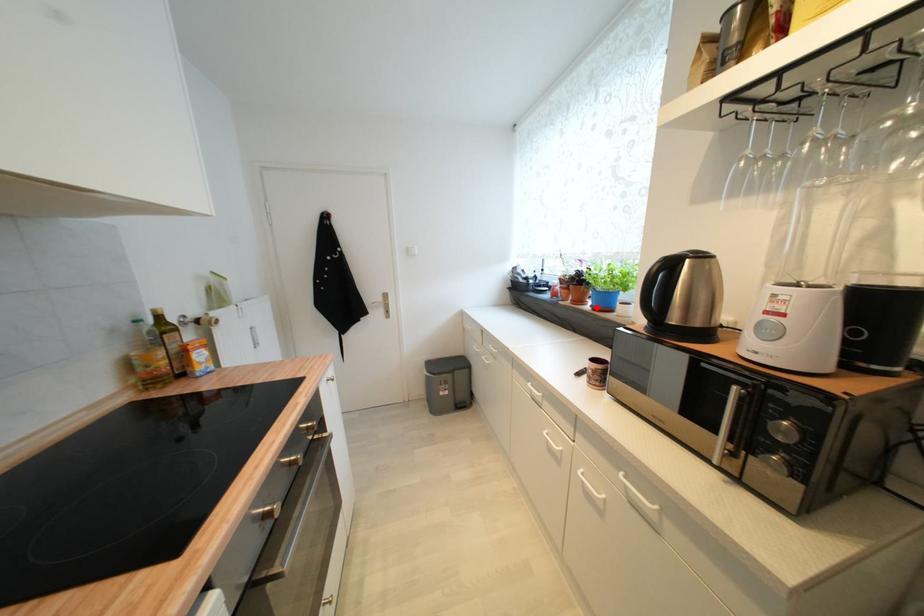
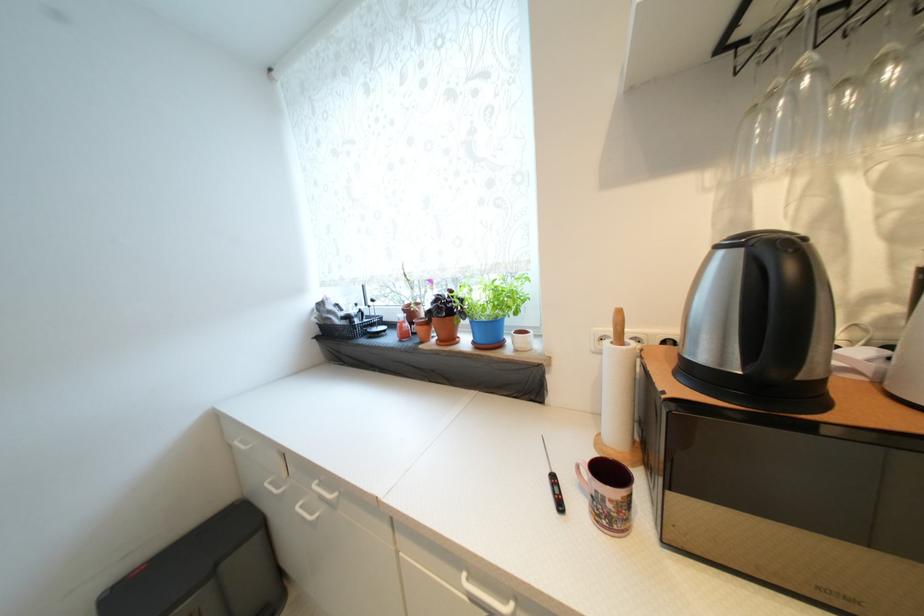
Find the pixel in the second image that matches the highlighted location in the first image.

(478, 344)